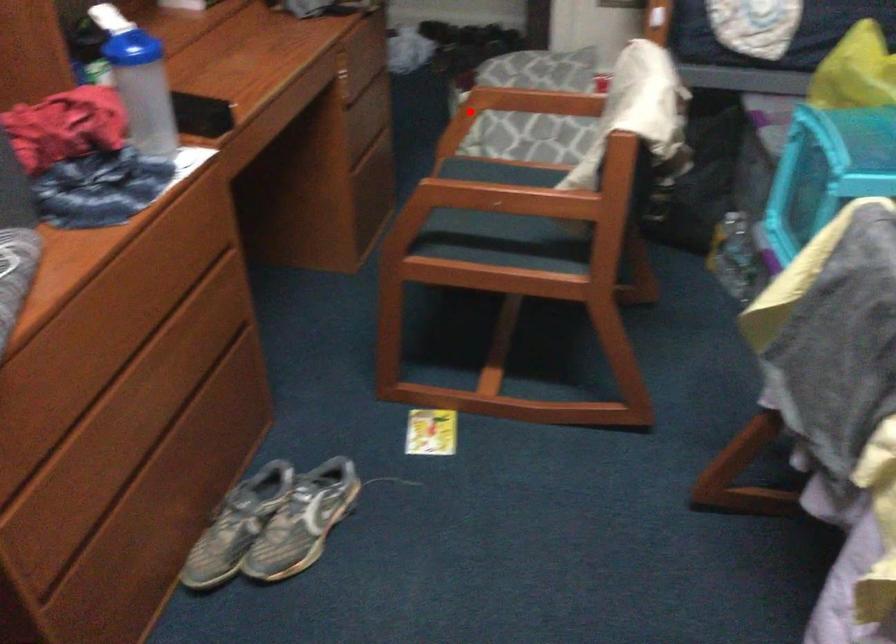
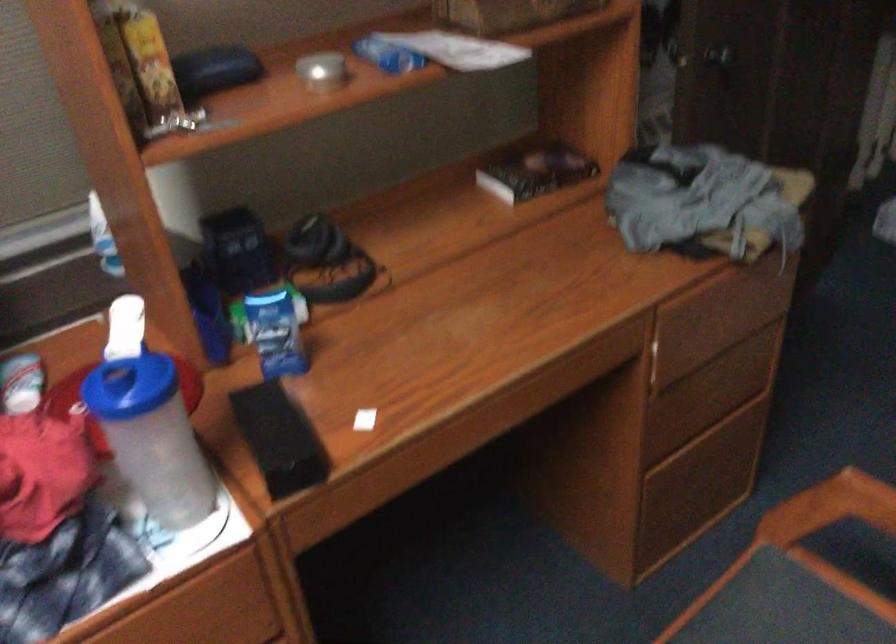
Question: A red point is marked in image1. In image2, is the corresponding 3D point closer to the camera or farther? Reply with the corresponding letter.

Choices:
 (A) The corresponding 3D point is closer.
 (B) The corresponding 3D point is farther.

Answer: (A)